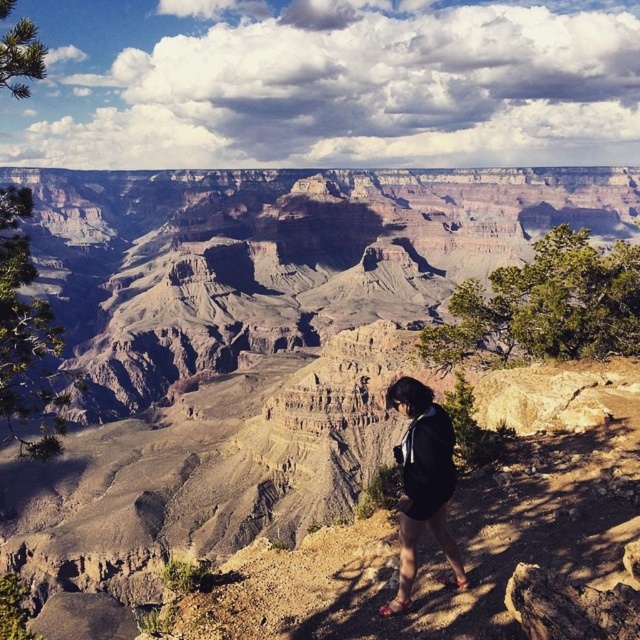
What are the coordinates of the brown rocky canyon at center?

The coordinates of the brown rocky canyon at center are 0.539 in the x direction and 0.388 in the y direction.

You are standing at the edge of the Grand Canyon and see the brown rocky canyon at center and the black fabric shorts at lower right. Which object is positioned more to the right side of your view?

The brown rocky canyon at center is positioned more to the right side of your view compared to the black fabric shorts at lower right.